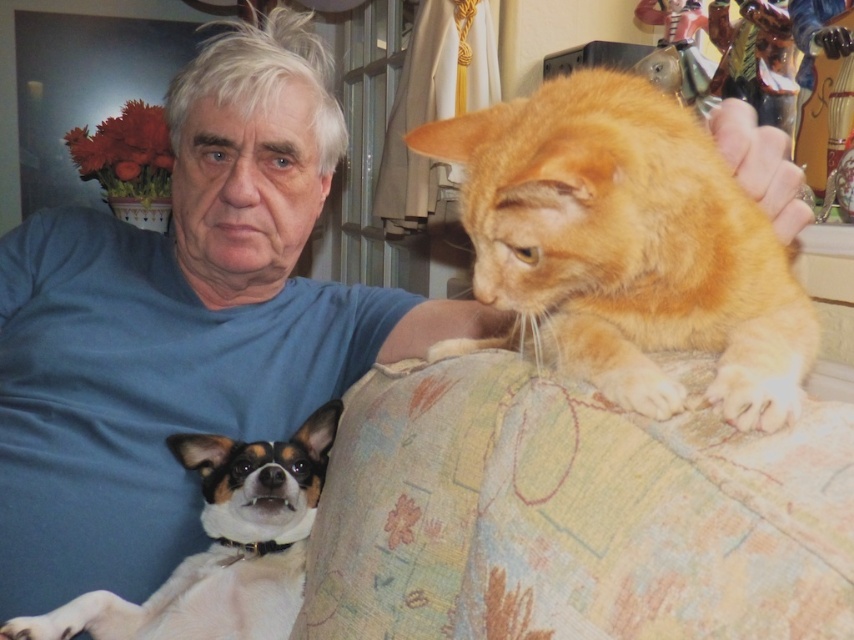
Question: Estimate the real-world distances between objects in this image. Which object is farther from the blue cotton shirt at upper left?

Choices:
 (A) orange fur cat at upper right
 (B) white fur dog at lower left

Answer: (A)

Question: Is blue cotton shirt at upper left smaller than orange fur cat at upper right?

Choices:
 (A) yes
 (B) no

Answer: (B)

Question: Considering the relative positions of blue cotton shirt at upper left and orange fur cat at upper right in the image provided, where is blue cotton shirt at upper left located with respect to orange fur cat at upper right?

Choices:
 (A) above
 (B) below

Answer: (A)

Question: Which of the following is the closest to the observer?

Choices:
 (A) (232, 502)
 (B) (244, 72)

Answer: (A)

Question: Which object appears farthest from the camera in this image?

Choices:
 (A) blue cotton shirt at upper left
 (B) white fur dog at lower left

Answer: (A)

Question: From the image, what is the correct spatial relationship of blue cotton shirt at upper left in relation to white fur dog at lower left?

Choices:
 (A) above
 (B) below

Answer: (A)